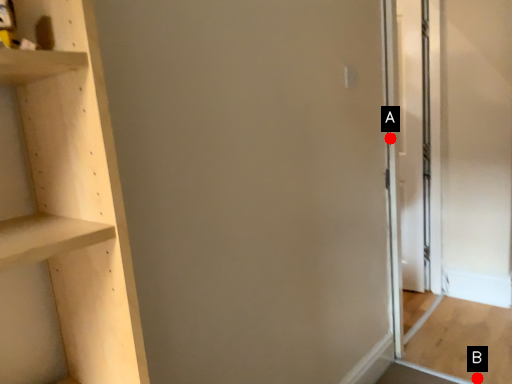
Question: Two points are circled on the image, labeled by A and B beside each circle. Which point is closer to the camera?

Choices:
 (A) A is closer
 (B) B is closer

Answer: (A)